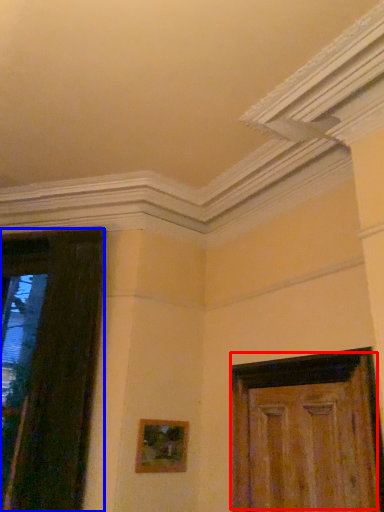
Question: Which object appears closest to the camera in this image, door (highlighted by a red box) or door (highlighted by a blue box)?

Choices:
 (A) door
 (B) door

Answer: (A)